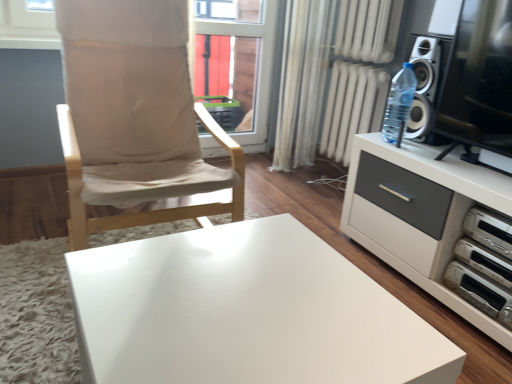
Where is `free space in front of white sheer curtain at center`? Image resolution: width=512 pixels, height=384 pixels. free space in front of white sheer curtain at center is located at coordinates (312, 177).